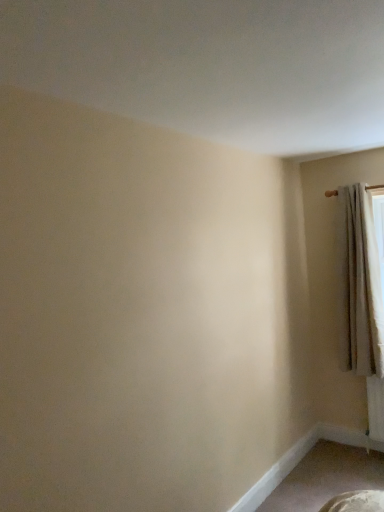
What is the approximate width of beige textured curtain at right?

The width of beige textured curtain at right is 9.35 inches.

Locate an element on the screen. The height and width of the screenshot is (512, 384). beige textured curtain at right is located at coordinates (359, 285).

This screenshot has width=384, height=512. Describe the element at coordinates (359, 285) in the screenshot. I see `beige textured curtain at right` at that location.

Measure the distance between point (348, 254) and camera.

Point (348, 254) and camera are 3.10 meters apart from each other.

Where is `beige textured curtain at right`? This screenshot has width=384, height=512. beige textured curtain at right is located at coordinates (359, 285).